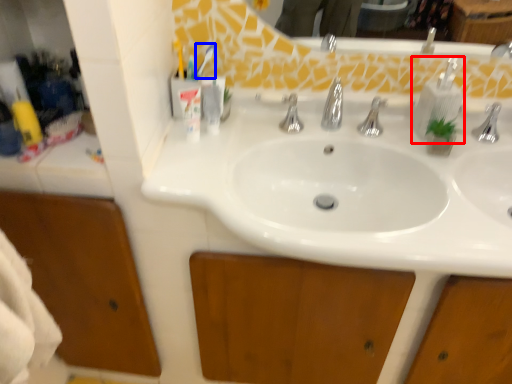
Question: Which object appears farthest to the camera in this image, soap dispenser (highlighted by a red box) or toothbrush (highlighted by a blue box)?

Choices:
 (A) soap dispenser
 (B) toothbrush

Answer: (B)